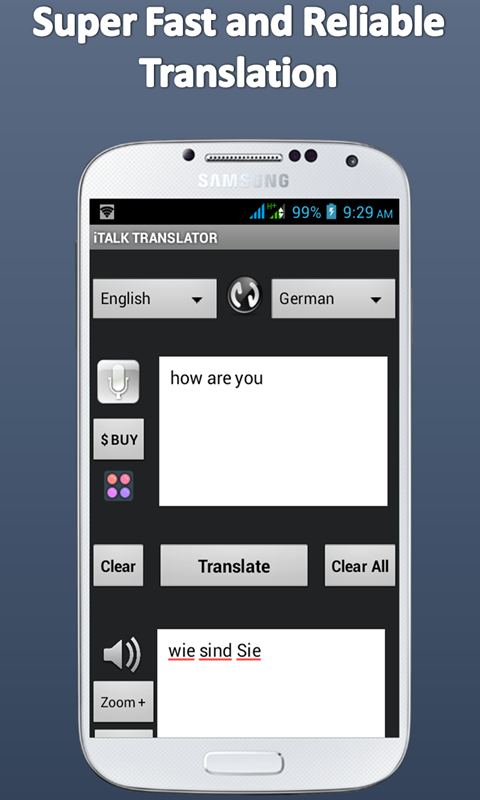
In order to click on wifi in this screenshot , I will do `click(100, 205)`.